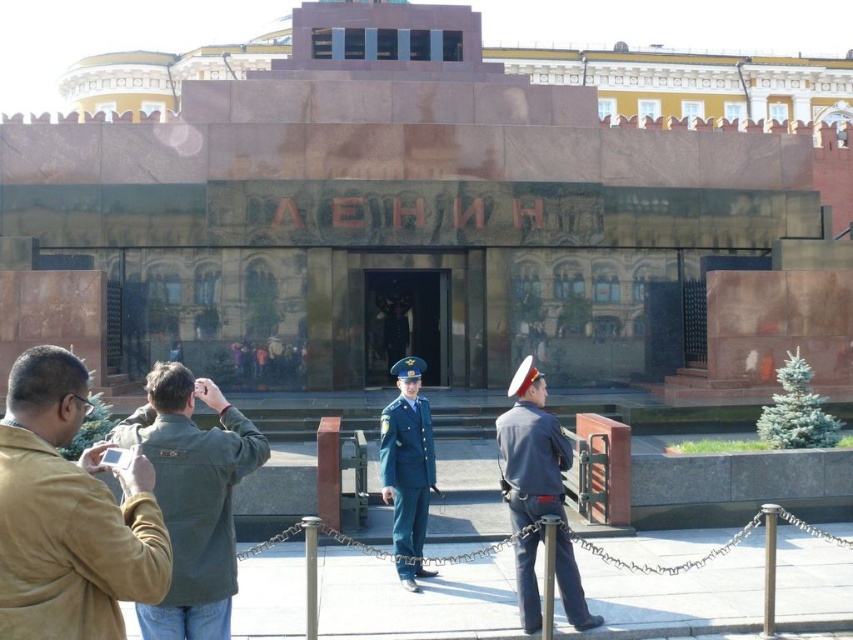
You are a photographer trying to capture both the tan suede jacket at lower left and the green fabric uniform at center in a single frame. Which object should you focus on first to ensure both are in the frame?

The tan suede jacket at lower left is smaller than the green fabric uniform at center, so you should focus on the smaller object first to ensure both fit in the frame.

You are a visitor approaching the memorial building and notice a point marked at coordinates (x=68, y=515). Which object is this point located on?

The point at (x=68, y=515) is located on the tan suede jacket at lower left.

You are a visitor approaching the memorial. You see the brown polished stone monument at center and the tan suede jacket at lower left. Which object is positioned higher from the ground?

The brown polished stone monument at center is above tan suede jacket at lower left, so the monument is higher from the ground.